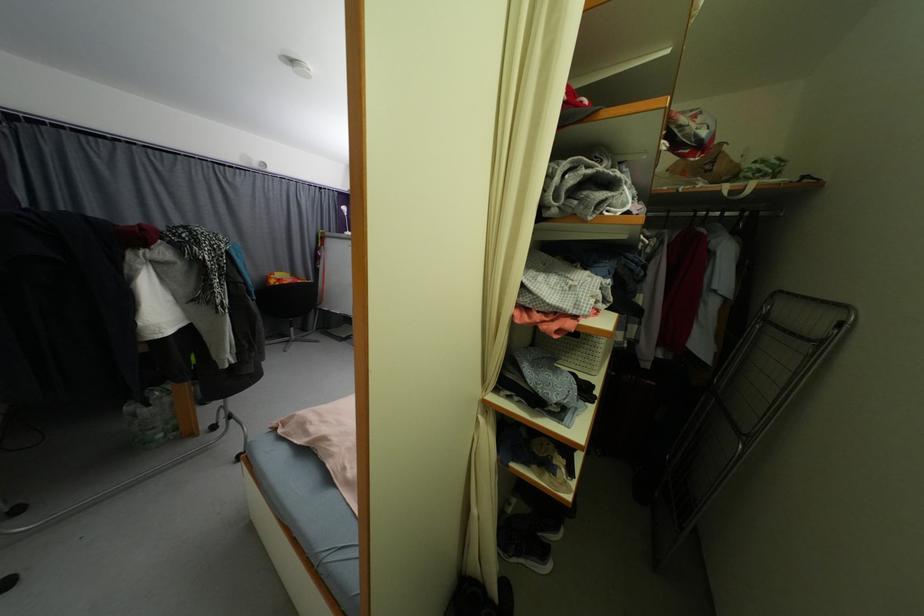
Which object does [148,424] point to?

It corresponds to the clear plastic bottle in the image.